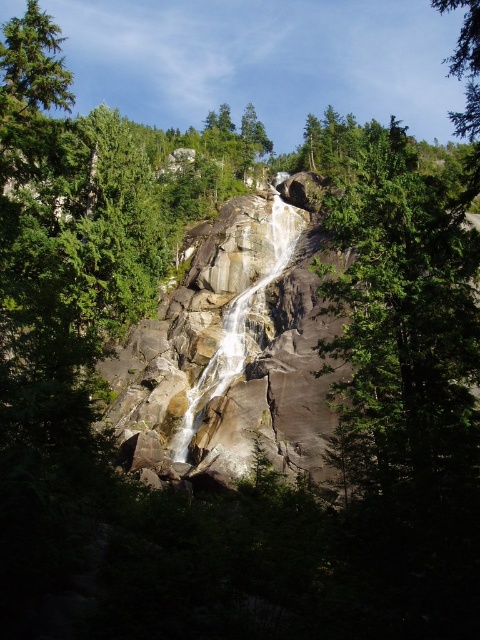
Does smooth gray rock waterfall at center appear on the right side of green textured tree at upper right?

In fact, smooth gray rock waterfall at center is to the left of green textured tree at upper right.

Is smooth gray rock waterfall at center wider than green textured tree at upper right?

Incorrect, smooth gray rock waterfall at center's width does not surpass green textured tree at upper right's.

Is point (187, 413) positioned in front of point (476, 104)?

No, (187, 413) is further to viewer.

The height and width of the screenshot is (640, 480). I want to click on smooth gray rock waterfall at center, so (238, 324).

Which is more to the right, green rough bark tree at center or smooth gray rock waterfall at center?

green rough bark tree at center

Which of these two, green rough bark tree at center or smooth gray rock waterfall at center, stands shorter?

smooth gray rock waterfall at center

Locate an element on the screen. green rough bark tree at center is located at coordinates (404, 323).

Does green rough bark tree at center have a smaller size compared to green textured tree at upper right?

Yes, green rough bark tree at center is smaller than green textured tree at upper right.

What do you see at coordinates (404, 323) in the screenshot? This screenshot has width=480, height=640. I see `green rough bark tree at center` at bounding box center [404, 323].

Locate an element on the screen. green rough bark tree at center is located at coordinates (404, 323).